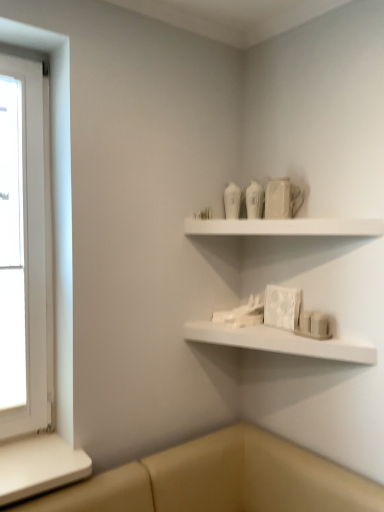
Question: From a real-world perspective, is white matte shelf at lower center, the 2th shelf viewed from the top, positioned over white wooden window at left based on gravity?

Choices:
 (A) yes
 (B) no

Answer: (B)

Question: Can you confirm if white matte shelf at lower center, the 2th shelf viewed from the top, is wider than white wooden window at left?

Choices:
 (A) no
 (B) yes

Answer: (B)

Question: Does white matte shelf at lower center, the 2th shelf viewed from the top, appear on the right side of white wooden window at left?

Choices:
 (A) yes
 (B) no

Answer: (A)

Question: From the image's perspective, is white matte shelf at lower center, which is the 1th shelf in bottom-to-top order, beneath white wooden window at left?

Choices:
 (A) yes
 (B) no

Answer: (A)

Question: Considering the relative sizes of white matte shelf at lower center, which is the 1th shelf in bottom-to-top order, and white wooden window at left in the image provided, is white matte shelf at lower center, which is the 1th shelf in bottom-to-top order, thinner than white wooden window at left?

Choices:
 (A) yes
 (B) no

Answer: (B)

Question: From a real-world perspective, is white matte shelf at upper center, which ranks as the first shelf in top-to-bottom order, positioned above or below white wooden window at left?

Choices:
 (A) above
 (B) below

Answer: (A)

Question: Considering the positions of white matte shelf at upper center, which ranks as the first shelf in top-to-bottom order, and white wooden window at left in the image, is white matte shelf at upper center, which ranks as the first shelf in top-to-bottom order, wider or thinner than white wooden window at left?

Choices:
 (A) wide
 (B) thin

Answer: (A)

Question: Do you think white matte shelf at upper center, the second shelf when ordered from bottom to top, is within white wooden window at left, or outside of it?

Choices:
 (A) inside
 (B) outside

Answer: (B)

Question: Is point (345, 224) closer or farther from the camera than point (8, 138)?

Choices:
 (A) farther
 (B) closer

Answer: (B)

Question: Is white matte shelf at upper center, which ranks as the first shelf in top-to-bottom order, in front of or behind white matte shelf at lower center, the 2th shelf viewed from the top, in the image?

Choices:
 (A) behind
 (B) front

Answer: (B)

Question: Considering the positions of point (299, 227) and point (193, 326), is point (299, 227) closer or farther from the camera than point (193, 326)?

Choices:
 (A) closer
 (B) farther

Answer: (A)

Question: In terms of height, does white matte shelf at upper center, the second shelf when ordered from bottom to top, look taller or shorter compared to white matte shelf at lower center, the 2th shelf viewed from the top?

Choices:
 (A) tall
 (B) short

Answer: (A)

Question: Is white matte shelf at upper center, which ranks as the first shelf in top-to-bottom order, wider or thinner than white matte shelf at lower center, the 2th shelf viewed from the top?

Choices:
 (A) wide
 (B) thin

Answer: (B)

Question: Do you think white matte shelf at lower center, the 2th shelf viewed from the top, is within white matte shelf at upper center, the second shelf when ordered from bottom to top, or outside of it?

Choices:
 (A) outside
 (B) inside

Answer: (A)

Question: Is white matte shelf at lower center, the 2th shelf viewed from the top, taller or shorter than white matte shelf at upper center, which ranks as the first shelf in top-to-bottom order?

Choices:
 (A) tall
 (B) short

Answer: (B)